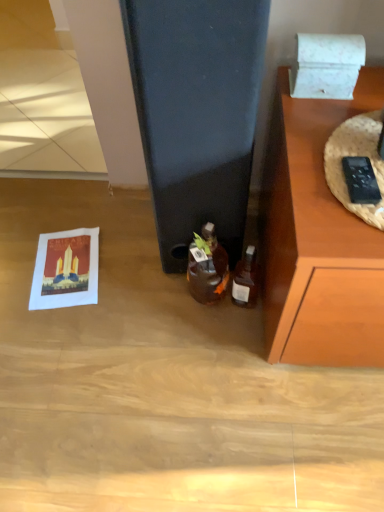
Question: Is matte paper postcard at lower left touching translucent glass bottle at lower right, which ranks as the 1th bottle in right-to-left order?

Choices:
 (A) yes
 (B) no

Answer: (B)

Question: From a real-world perspective, is matte paper postcard at lower left beneath translucent glass bottle at lower right, the 2th bottle when ordered from left to right?

Choices:
 (A) yes
 (B) no

Answer: (A)

Question: From a real-world perspective, does matte paper postcard at lower left stand above translucent glass bottle at lower right, the 2th bottle when ordered from left to right?

Choices:
 (A) yes
 (B) no

Answer: (B)

Question: Is matte paper postcard at lower left aimed at translucent glass bottle at lower right, the 2th bottle when ordered from left to right?

Choices:
 (A) yes
 (B) no

Answer: (B)

Question: Is matte paper postcard at lower left behind translucent glass bottle at lower right, which ranks as the 1th bottle in right-to-left order?

Choices:
 (A) yes
 (B) no

Answer: (A)

Question: Considering the relative sizes of matte paper postcard at lower left and translucent glass bottle at lower right, the 2th bottle when ordered from left to right, in the image provided, is matte paper postcard at lower left thinner than translucent glass bottle at lower right, the 2th bottle when ordered from left to right,?

Choices:
 (A) yes
 (B) no

Answer: (B)

Question: Can you confirm if black plastic remote control at right is taller than white marble box at upper right?

Choices:
 (A) no
 (B) yes

Answer: (A)

Question: Is the depth of black plastic remote control at right less than that of white marble box at upper right?

Choices:
 (A) yes
 (B) no

Answer: (A)

Question: Does black plastic remote control at right appear on the left side of white marble box at upper right?

Choices:
 (A) yes
 (B) no

Answer: (B)

Question: Is black plastic remote control at right further to the viewer compared to white marble box at upper right?

Choices:
 (A) no
 (B) yes

Answer: (A)

Question: Is black plastic remote control at right shorter than white marble box at upper right?

Choices:
 (A) yes
 (B) no

Answer: (A)

Question: Is black plastic remote control at right surrounding white marble box at upper right?

Choices:
 (A) yes
 (B) no

Answer: (B)

Question: From a real-world perspective, is translucent glass bottle at lower right, which ranks as the 1th bottle in right-to-left order, under white marble box at upper right?

Choices:
 (A) yes
 (B) no

Answer: (A)